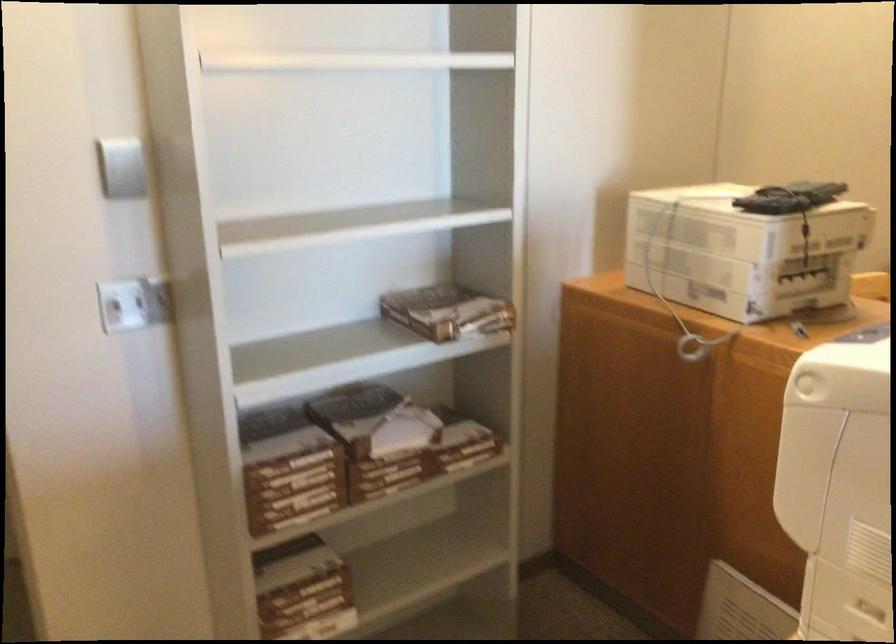
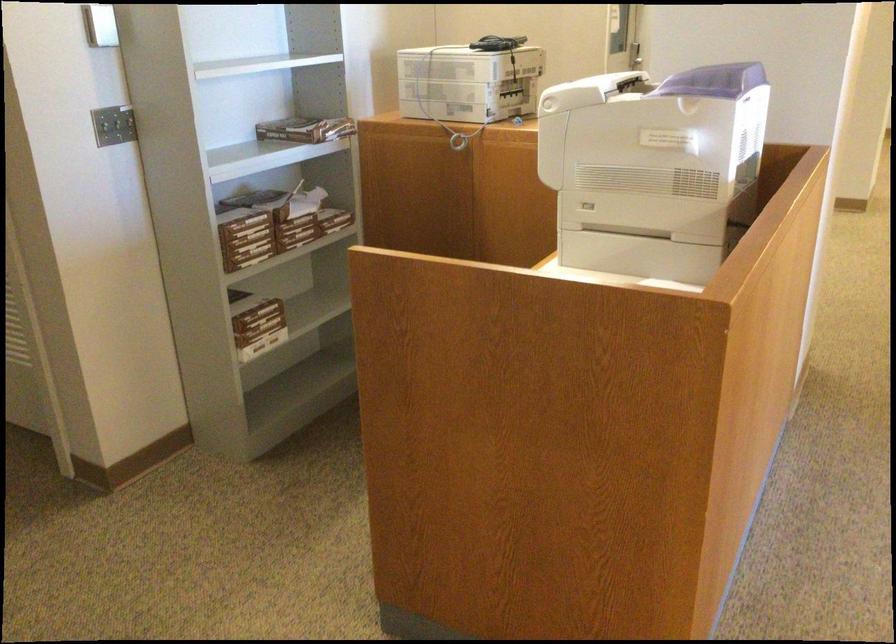
In the second image, find the point that corresponds to the point at 386,482 in the first image.

(297, 231)